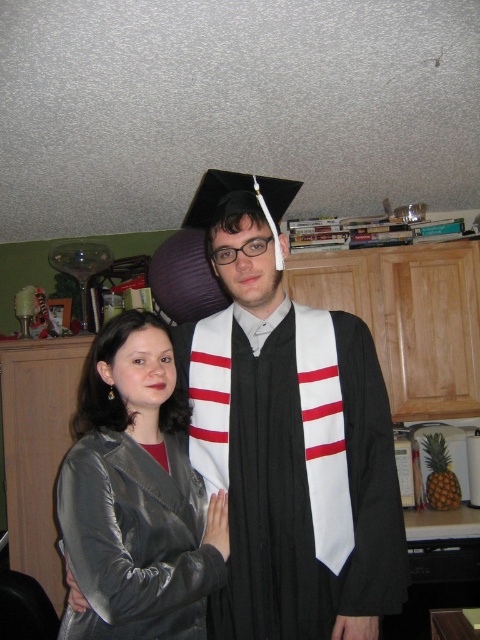
Does black matte graduation gown at center have a smaller size compared to satin silver jacket at center?

No, black matte graduation gown at center is not smaller than satin silver jacket at center.

Looking at this image, who is shorter, black matte graduation gown at center or satin silver jacket at center?

With less height is satin silver jacket at center.

Which is behind, point (182, 381) or point (60, 628)?

Positioned behind is point (182, 381).

Find the location of `black matte graduation gown at center`. black matte graduation gown at center is located at coordinates 288,436.